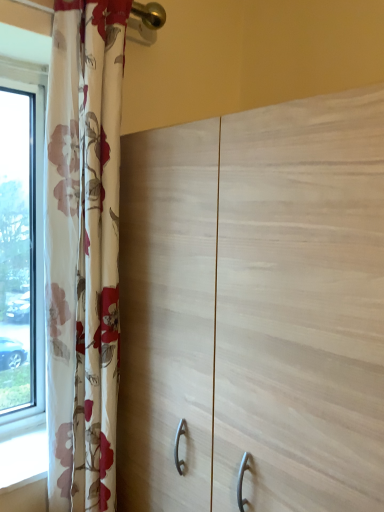
Question: Is light wood cupboard at center thinner than floral fabric curtain at left?

Choices:
 (A) no
 (B) yes

Answer: (A)

Question: Considering the relative positions of light wood cupboard at center and floral fabric curtain at left in the image provided, is light wood cupboard at center to the left of floral fabric curtain at left from the viewer's perspective?

Choices:
 (A) no
 (B) yes

Answer: (A)

Question: Does light wood cupboard at center have a lesser height compared to floral fabric curtain at left?

Choices:
 (A) no
 (B) yes

Answer: (B)

Question: Is light wood cupboard at center far from floral fabric curtain at left?

Choices:
 (A) no
 (B) yes

Answer: (A)

Question: Considering the relative sizes of light wood cupboard at center and floral fabric curtain at left in the image provided, is light wood cupboard at center wider than floral fabric curtain at left?

Choices:
 (A) no
 (B) yes

Answer: (B)

Question: Is floral fabric curtain at left at the back of light wood cupboard at center?

Choices:
 (A) no
 (B) yes

Answer: (A)

Question: Considering the relative sizes of floral fabric curtain at left and light wood cupboard at center in the image provided, is floral fabric curtain at left thinner than light wood cupboard at center?

Choices:
 (A) yes
 (B) no

Answer: (A)

Question: Is floral fabric curtain at left at the left side of light wood cupboard at center?

Choices:
 (A) no
 (B) yes

Answer: (B)

Question: Is light wood cupboard at center inside floral fabric curtain at left?

Choices:
 (A) yes
 (B) no

Answer: (B)

Question: Is floral fabric curtain at left positioned with its back to light wood cupboard at center?

Choices:
 (A) yes
 (B) no

Answer: (B)

Question: Is the position of floral fabric curtain at left more distant than that of light wood cupboard at center?

Choices:
 (A) yes
 (B) no

Answer: (A)

Question: Is floral fabric curtain at left closer to the viewer compared to light wood cupboard at center?

Choices:
 (A) no
 (B) yes

Answer: (A)

Question: Considering the positions of light wood cupboard at center and floral fabric curtain at left in the image, is light wood cupboard at center taller or shorter than floral fabric curtain at left?

Choices:
 (A) tall
 (B) short

Answer: (B)